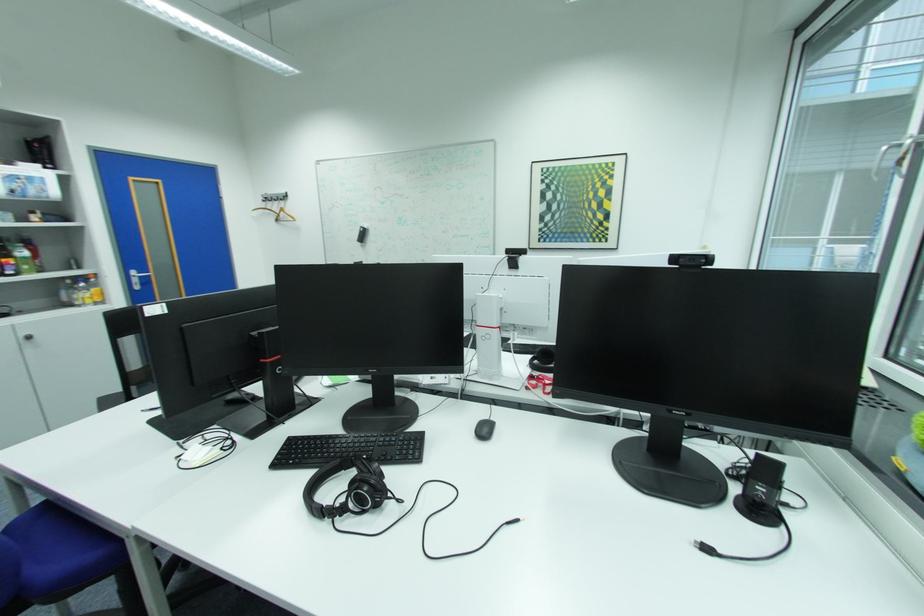
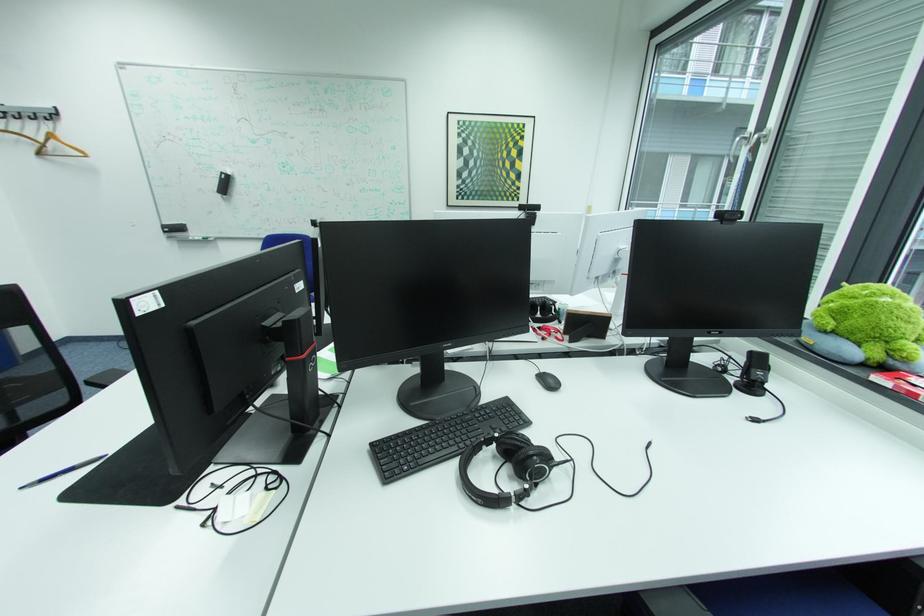
Where in the second image is the point corresponding to (x=285, y=221) from the first image?

(49, 153)